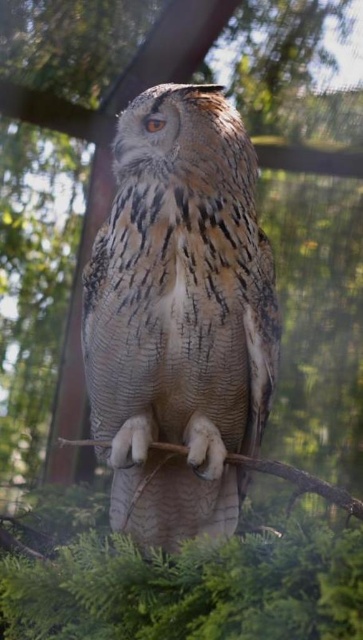
Question: Which point is farther to the camera?

Choices:
 (A) (352, 506)
 (B) (155, 493)

Answer: (B)

Question: Is speckled feathered owl at center below brown textured stick at center?

Choices:
 (A) no
 (B) yes

Answer: (A)

Question: Where is speckled feathered owl at center located in relation to brown textured stick at center in the image?

Choices:
 (A) left
 (B) right

Answer: (A)

Question: From the image, what is the correct spatial relationship of speckled feathered owl at center in relation to brown textured stick at center?

Choices:
 (A) below
 (B) above

Answer: (B)